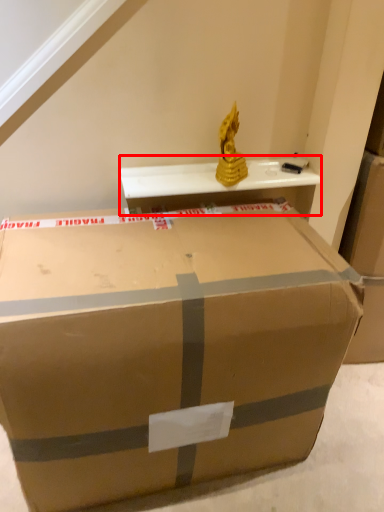
Question: In this image, where is table (annotated by the red box) located relative to box?

Choices:
 (A) left
 (B) right

Answer: (B)